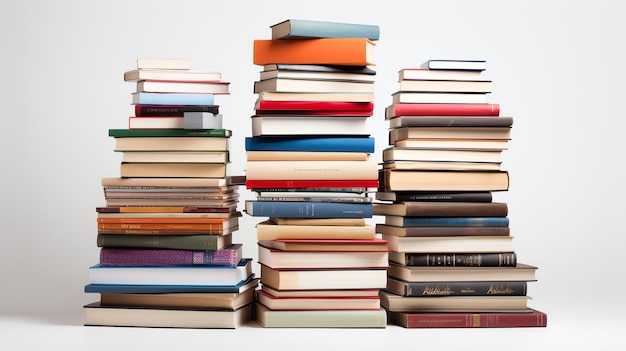
Where is `red books`? red books is located at coordinates (356, 180), (270, 296), (334, 105), (341, 109), (401, 106), (175, 80), (136, 117), (433, 320), (307, 239).